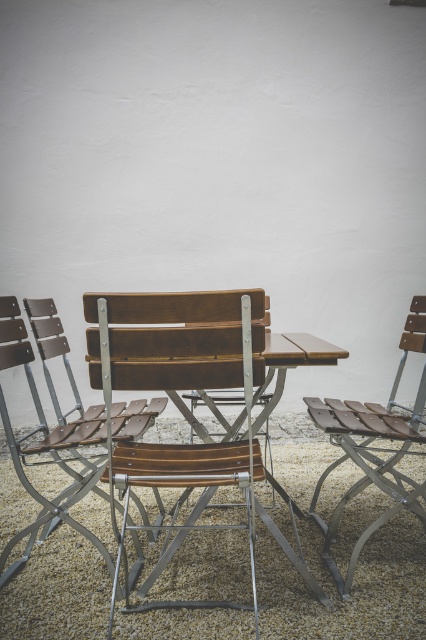
You are a painter who needs to move a ladder between the wooden slats chair at center and the brown wood chair at right. The ladder is 22 inches wide. Do you think you can fit the ladder between them without moving the chairs?

The wooden slats chair at center and brown wood chair at right are 20.95 inches apart, so the ladder which is 22 inches wide cannot fit between them as the space is narrower than the ladder.

You are planning to place a new rectangular plant pot that is 1.2 meters wide between the brown leather chair at center and the brown wood chair at right. Based on the scene description, will the plant pot fit between them without touching either chair?

The brown leather chair at center is wider than the brown wood chair at right. Since the plant pot is 1.2 meters wide, it might not fit if the distance between the chairs is less than 1.2 meters. However, the exact spacing isn

You are a person with a 12 inch wide backpack. You want to walk between the wooden slats chair at center and the brown leather chair at center. Can you fit through the space between them without touching either chair?

The wooden slats chair at center and brown leather chair at center are 13.18 inches apart from each other. Since your backpack is 12 inches wide, you can fit through the space between them without touching either chair.